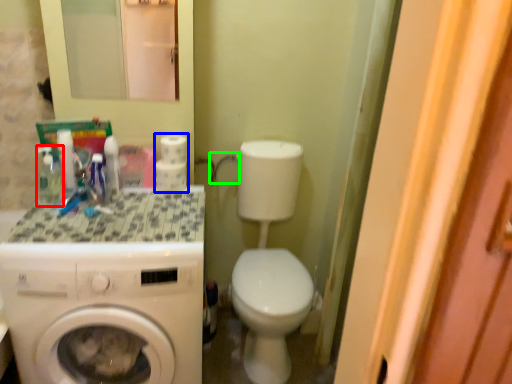
Question: Considering the real-world distances, which object is farthest from mouthwash (highlighted by a red box)? toilet paper (highlighted by a blue box) or faucet (highlighted by a green box)?

Choices:
 (A) toilet paper
 (B) faucet

Answer: (B)